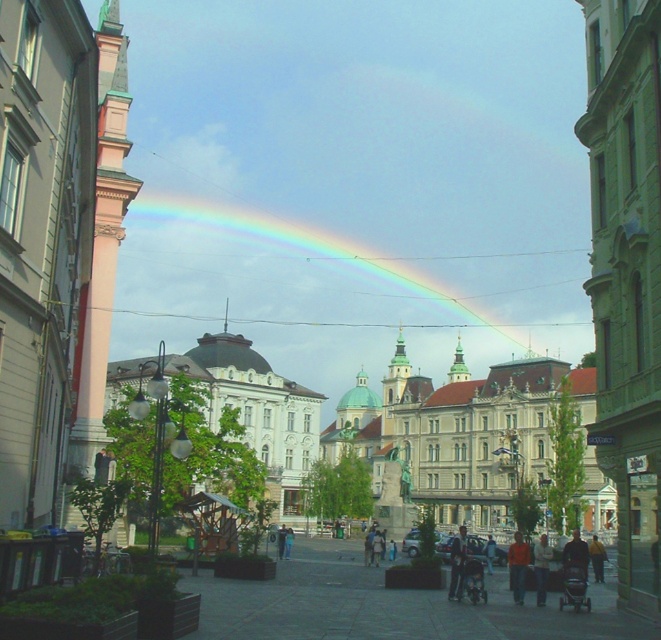
Does dark blue jeans at center appear over light brown leather jacket at lower center?

No, dark blue jeans at center is not above light brown leather jacket at lower center.

Can you confirm if dark blue jeans at center is positioned below light brown leather jacket at lower center?

Indeed, dark blue jeans at center is positioned under light brown leather jacket at lower center.

At what (x,y) coordinates should I click in order to perform the action: click on dark blue jeans at center. Please return your answer as a coordinate pair (x, y). Looking at the image, I should click on (457, 563).

This screenshot has width=661, height=640. Find the location of `dark blue jeans at center`. dark blue jeans at center is located at coordinates (457, 563).

Is rainbow at center thinner than dark blue jeans at center?

Incorrect, rainbow at center's width is not less than dark blue jeans at center's.

Between rainbow at center and dark blue jeans at center, which one has less height?

Standing shorter between the two is dark blue jeans at center.

Where is `rainbow at center`? The image size is (661, 640). rainbow at center is located at coordinates (297, 275).

Does white stone building at center come in front of rainbow at center?

That is True.

Can you confirm if white stone building at center is positioned below rainbow at center?

Yes, white stone building at center is below rainbow at center.

Who is more distant from viewer, (208, 372) or (284, 259)?

The point (284, 259) is more distant.

The image size is (661, 640). What are the coordinates of `white stone building at center` in the screenshot? It's located at (403, 422).